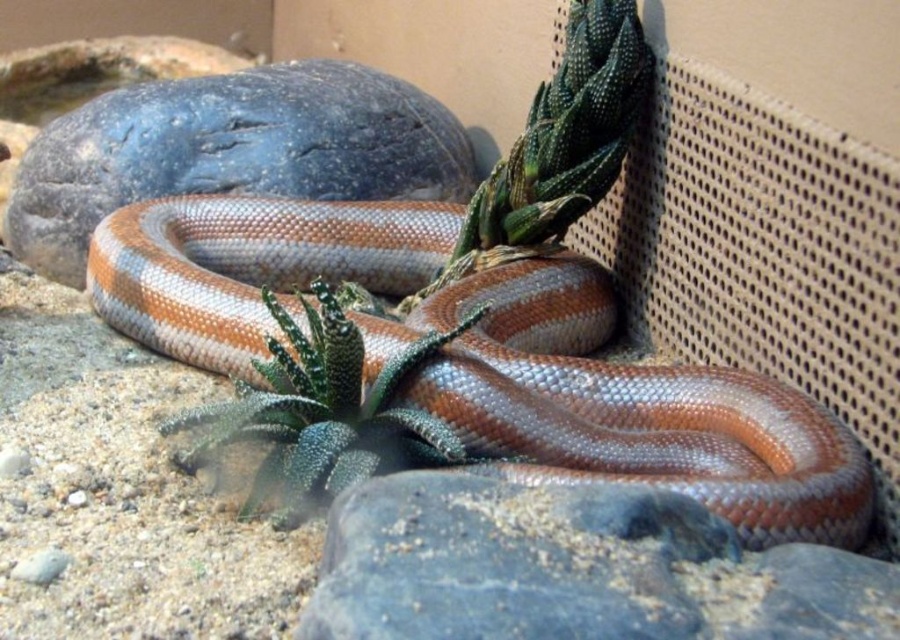
Between point (684, 477) and point (585, 497), which one is positioned in front?

Point (585, 497) is more forward.

Is shiny brown snake at center below smooth gray rock at lower center?

Actually, shiny brown snake at center is above smooth gray rock at lower center.

Who is more forward, (x=691, y=436) or (x=388, y=486)?

Point (x=388, y=486)

Where is `shiny brown snake at center`? This screenshot has width=900, height=640. shiny brown snake at center is located at coordinates (627, 406).

Does shiny brown snake at center have a greater width compared to smooth gray rock at upper left?

Indeed, shiny brown snake at center has a greater width compared to smooth gray rock at upper left.

Image resolution: width=900 pixels, height=640 pixels. What do you see at coordinates (627, 406) in the screenshot? I see `shiny brown snake at center` at bounding box center [627, 406].

I want to click on shiny brown snake at center, so click(x=627, y=406).

Is point (596, 548) farther from camera compared to point (339, 189)?

No, (596, 548) is in front of (339, 189).

Which is above, smooth gray rock at lower center or smooth gray rock at upper left?

Positioned higher is smooth gray rock at upper left.

Which is behind, point (783, 548) or point (284, 115)?

Point (284, 115)

What are the coordinates of `smooth gray rock at lower center` in the screenshot? It's located at (573, 568).